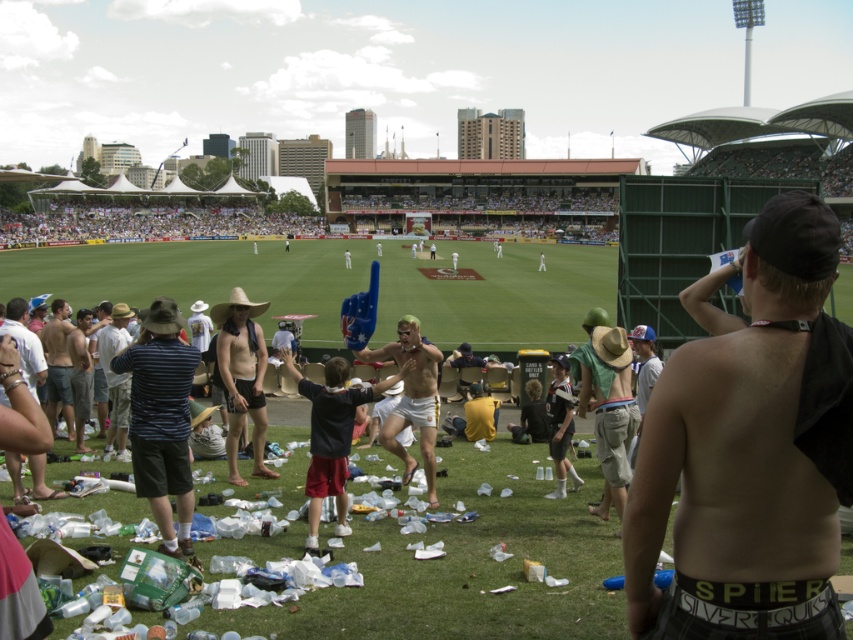
What are the coordinates of the green straw hat at right?

The green straw hat at right is located at point (608, 410).

You are a photographer trying to capture a closeup shot of the shiny black tank top at right without including the green grass at center in the frame. Given their relative sizes, is this feasible?

The shiny black tank top at right is narrower than the green grass at center, so it might be challenging to exclude the green grass at center from the frame without cropping the tank top.

What is located at the coordinate point (161, 419) in the image?

The striped fabric shirt at left is located at the coordinate point (161, 419).